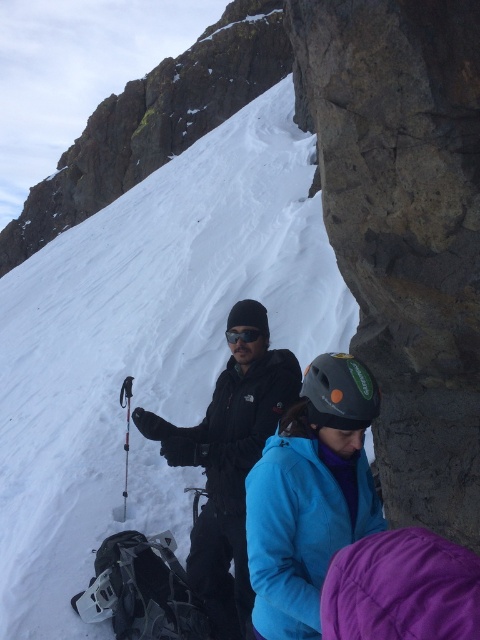
You are a mountaineer planning to reach the summit. You see the matte blue jacket at center and the dark winter gear on the left. Which climber is closer to the summit based on their positions?

The matte blue jacket at center is located at point [310,496], which is higher up the slope compared to the dark winter gear on the left. Therefore, the climber in the matte blue jacket at center is closer to the summit.

Based on the photo, you are a mountaineer planning to move from the white powder snow at center to the black matte goggles at center. Given the distance between them is 15.02 meters, and your average climbing speed is 2 meters per minute, how many minutes will it take you to reach the goggles from the snow?

The distance between the white powder snow at center and the black matte goggles at center is 15.02 meters. At a speed of 2 meters per minute, dividing the distance by the speed gives 15.02 divided by 2 equals 7.51 minutes. Therefore, it will take approximately 7.51 minutes to reach the goggles from the snow.